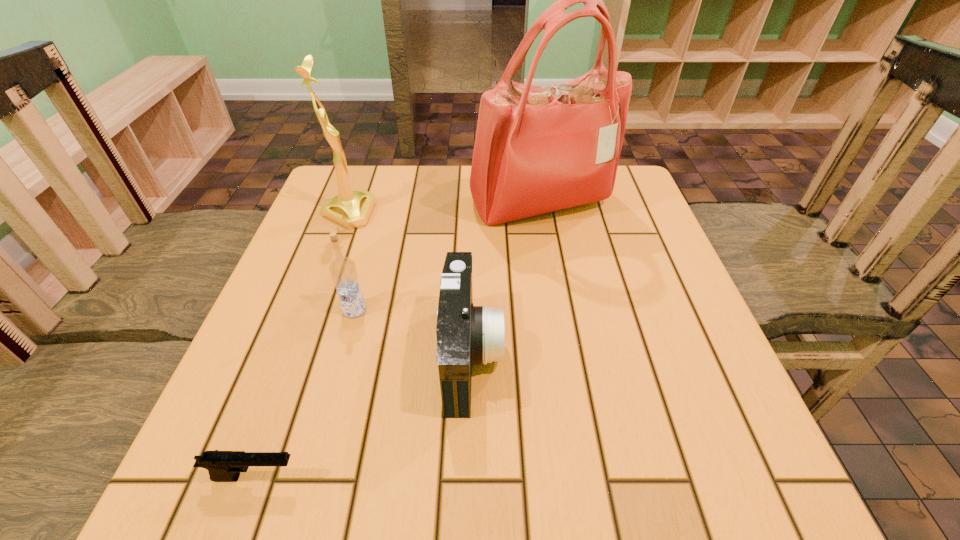
In order to click on vacant space that is in between the second shortest object and the fourth shortest object in this screenshot , I will do `click(410, 285)`.

Find the location of `unoccupied position between the third shortest object and the nearest object`. unoccupied position between the third shortest object and the nearest object is located at coordinates (304, 394).

Where is `free spot between the fourth tallest object and the shortest object`? This screenshot has width=960, height=540. free spot between the fourth tallest object and the shortest object is located at coordinates (363, 416).

Find the location of a particular element. Image resolution: width=960 pixels, height=540 pixels. empty space that is in between the handbag and the shortest object is located at coordinates (397, 341).

The height and width of the screenshot is (540, 960). What are the coordinates of `empty location between the nearest object and the vodka` in the screenshot? It's located at (304, 394).

Identify which object is the third nearest to the tallest object. Please provide its 2D coordinates. Your answer should be formatted as a tuple, i.e. [(x, y)], where the tuple contains the x and y coordinates of a point satisfying the conditions above.

[(343, 271)]

Locate which object ranks second in proximity to the award. Please provide its 2D coordinates. Your answer should be formatted as a tuple, i.e. [(x, y)], where the tuple contains the x and y coordinates of a point satisfying the conditions above.

[(538, 149)]

At what (x,y) coordinates should I click in order to perform the action: click on vacant space that satisfies the following two spatial constraints: 1. on the front-facing side of the tallest object; 2. on the front-facing side of the nearest object. Please return your answer as a coordinate pair (x, y). This screenshot has height=540, width=960. Looking at the image, I should click on (587, 477).

The image size is (960, 540). Identify the location of free point that satisfies the following two spatial constraints: 1. on the front-facing side of the handbag; 2. on the front-facing side of the shortest object. (587, 477).

Where is `free space in the image that satisfies the following two spatial constraints: 1. on the front-facing side of the tallest object; 2. on the front-facing side of the shortest object`? This screenshot has height=540, width=960. free space in the image that satisfies the following two spatial constraints: 1. on the front-facing side of the tallest object; 2. on the front-facing side of the shortest object is located at coordinates (587, 477).